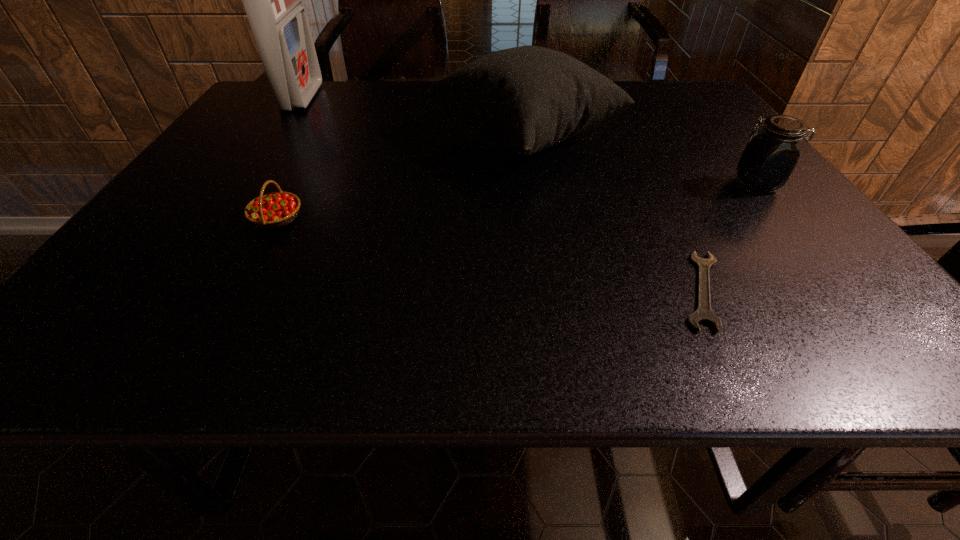
Find the location of `free spot between the strawberry and the rightmost object`. free spot between the strawberry and the rightmost object is located at coordinates (516, 202).

At what (x,y) coordinates should I click in order to perform the action: click on vacant area that lies between the wrench and the fourth tallest object. Please return your answer as a coordinate pair (x, y). The height and width of the screenshot is (540, 960). Looking at the image, I should click on (490, 255).

You are a GUI agent. You are given a task and a screenshot of the screen. Output one action in this format:
    pyautogui.click(x=<x>, y=<y>)
    Task: Click on the vacant area that lies between the third shortest object and the shortest object
    The height and width of the screenshot is (540, 960).
    Given the screenshot: What is the action you would take?
    pyautogui.click(x=729, y=237)

You are a GUI agent. You are given a task and a screenshot of the screen. Output one action in this format:
    pyautogui.click(x=<x>, y=<y>)
    Task: Click on the free space between the cushion and the third tallest object
    
    Given the screenshot: What is the action you would take?
    pyautogui.click(x=640, y=160)

You are a GUI agent. You are given a task and a screenshot of the screen. Output one action in this format:
    pyautogui.click(x=<x>, y=<y>)
    Task: Click on the free space between the nearest object and the fourth shortest object
    
    Given the screenshot: What is the action you would take?
    pyautogui.click(x=613, y=213)

I want to click on vacant space that is in between the tallest object and the strawberry, so click(290, 159).

At what (x,y) coordinates should I click in order to perform the action: click on vacant area between the leftmost object and the second tallest object. Please return your answer as a coordinate pair (x, y). This screenshot has width=960, height=540. Looking at the image, I should click on (414, 117).

Locate an element on the screen. free spot between the tallest object and the second nearest object is located at coordinates (290, 159).

Identify the location of object that is the fourth closest to the fourth tallest object. The width and height of the screenshot is (960, 540). (770, 156).

Where is `object that stands as the third closest to the first-aid kit`? This screenshot has width=960, height=540. object that stands as the third closest to the first-aid kit is located at coordinates (703, 313).